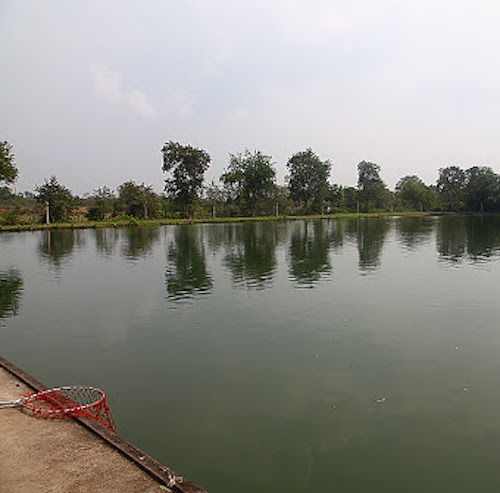
At what (x,y) coordinates should I click in order to perform the action: click on metal handle. Please return your answer as a coordinate pair (x, y). The image size is (500, 493). Looking at the image, I should click on (14, 398).